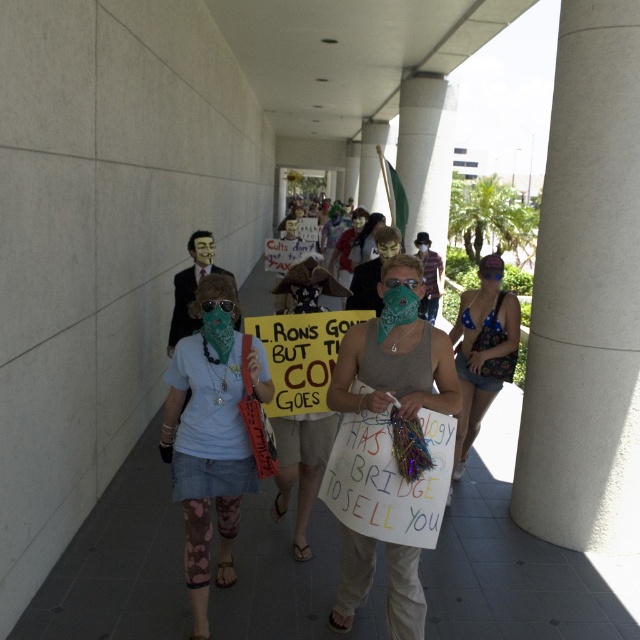
Does green bandana at center appear on the right side of blue bikini top at right?

In fact, green bandana at center is to the left of blue bikini top at right.

Which is behind, point (355, 561) or point (486, 384)?

Positioned behind is point (486, 384).

Between point (388, 307) and point (516, 320), which one is positioned behind?

The point (516, 320) is behind.

Locate an element on the screen. green bandana at center is located at coordinates (396, 353).

How far apart are light blue t-shirt at center and green bandana at center?

A distance of 36.91 inches exists between light blue t-shirt at center and green bandana at center.

Which of these two, light blue t-shirt at center or green bandana at center, stands shorter?

green bandana at center is shorter.

You are a GUI agent. You are given a task and a screenshot of the screen. Output one action in this format:
    pyautogui.click(x=<x>, y=<y>)
    Task: Click on the light blue t-shirt at center
    The width and height of the screenshot is (640, 640).
    Given the screenshot: What is the action you would take?
    pyautogui.click(x=211, y=435)

Is light blue t-shirt at center positioned before blue bikini top at right?

Yes, it is.

Can you confirm if light blue t-shirt at center is wider than blue bikini top at right?

No.

The height and width of the screenshot is (640, 640). In order to click on light blue t-shirt at center in this screenshot , I will do `click(211, 435)`.